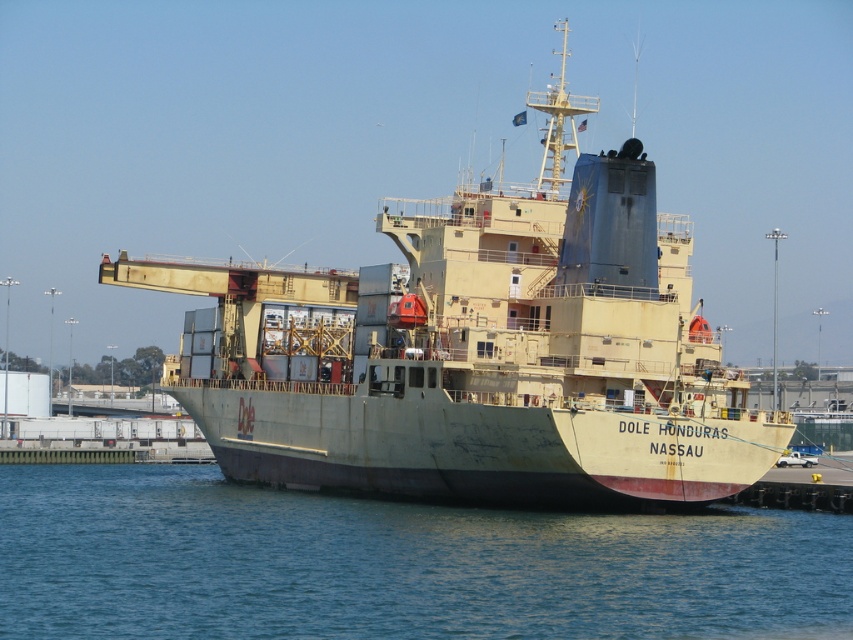
Question: Observing the image, what is the correct spatial positioning of light beige matte ship at center in reference to blue water at lower center?

Choices:
 (A) above
 (B) below

Answer: (A)

Question: Which of the following is the closest to the observer?

Choices:
 (A) blue water at lower center
 (B) light beige matte ship at center

Answer: (A)

Question: Does light beige matte ship at center have a lesser width compared to blue water at lower center?

Choices:
 (A) yes
 (B) no

Answer: (B)

Question: Which point is farther to the camera?

Choices:
 (A) (647, 352)
 (B) (621, 632)

Answer: (A)

Question: Is light beige matte ship at center closer to the viewer compared to blue water at lower center?

Choices:
 (A) no
 (B) yes

Answer: (A)